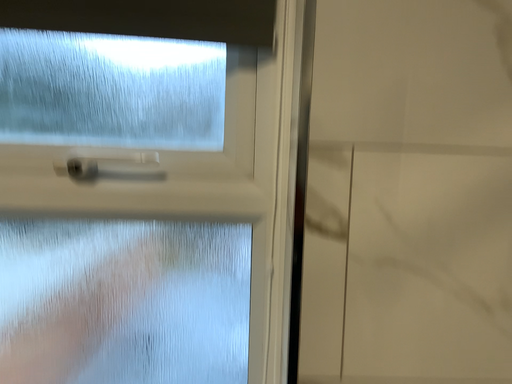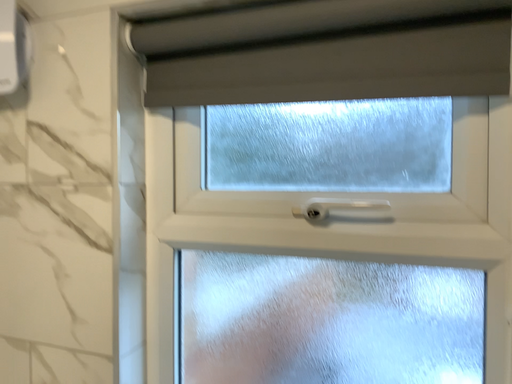
Question: How did the camera likely rotate when shooting the video?

Choices:
 (A) rotated left
 (B) rotated right

Answer: (A)